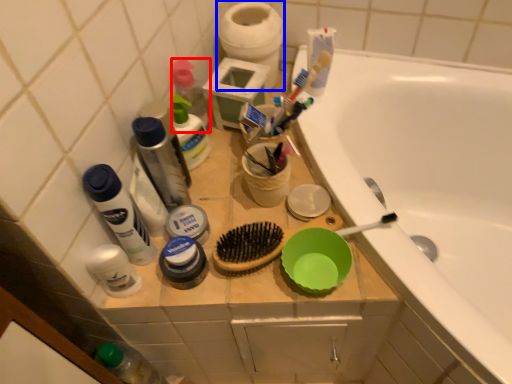
Question: Among these objects, which one is nearest to the camera, toiletry (highlighted by a red box) or toilet paper (highlighted by a blue box)?

Choices:
 (A) toiletry
 (B) toilet paper

Answer: (A)